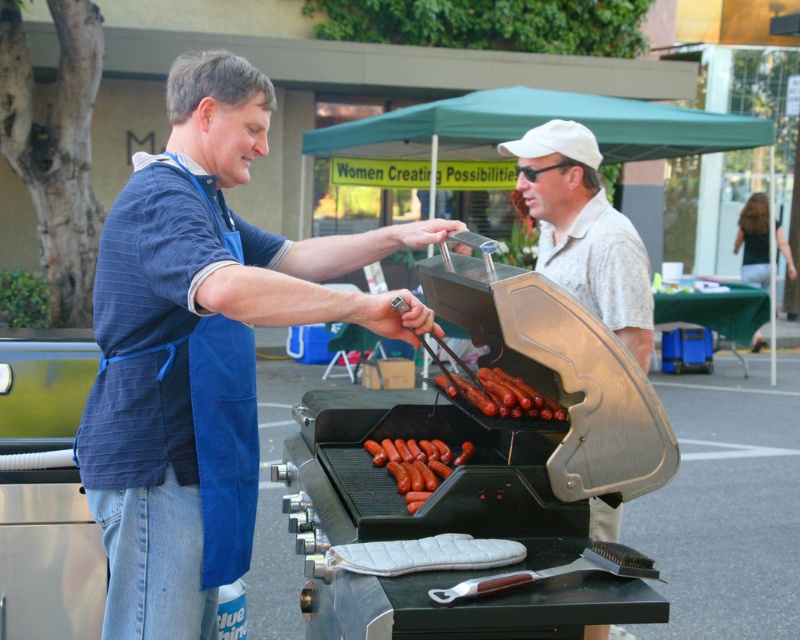
Which is above, blue apron at left or smooth brown sausages at center?

Positioned higher is blue apron at left.

Which is in front, point (270, 284) or point (425, 484)?

Point (270, 284) is in front.

Which is behind, point (244, 179) or point (458, 460)?

Point (458, 460)

Find the location of a particular element. The width and height of the screenshot is (800, 640). blue apron at left is located at coordinates (200, 349).

Based on the photo, is white cap at upper center to the left of smooth brown sausages at center from the viewer's perspective?

No, white cap at upper center is not to the left of smooth brown sausages at center.

Can you confirm if white cap at upper center is bigger than smooth brown sausages at center?

Yes.

Which is in front, point (532, 216) or point (396, 442)?

Point (396, 442) is in front.

Locate an element on the screen. The image size is (800, 640). white cap at upper center is located at coordinates (584, 230).

Who is lower down, blue apron at left or shiny brown sausages at center?

blue apron at left is below.

Is the position of blue apron at left less distant than that of shiny brown sausages at center?

That is True.

Is point (298, 269) positioned behind point (548, 412)?

Yes, it is behind point (548, 412).

I want to click on blue apron at left, so click(x=200, y=349).